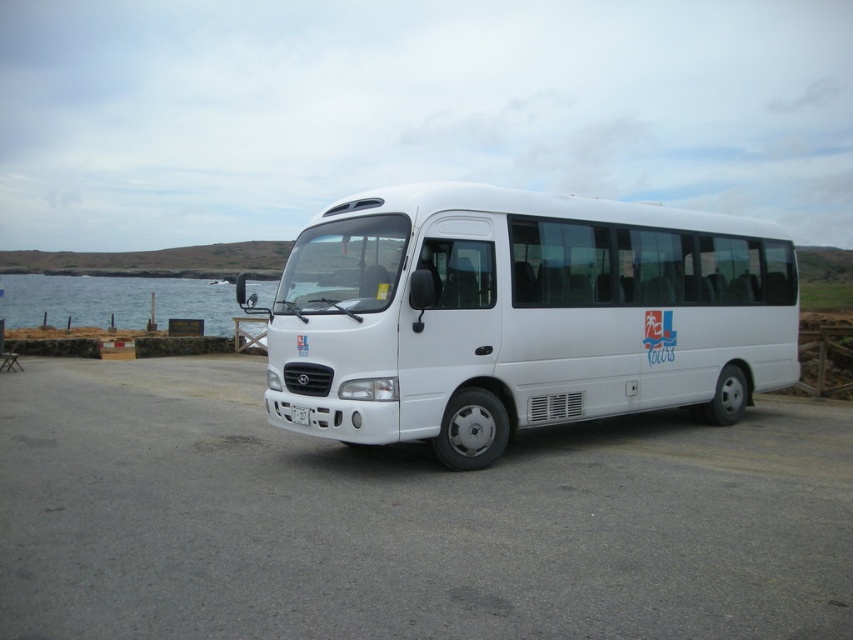
This screenshot has height=640, width=853. I want to click on white asphalt parking lot at center, so click(405, 522).

Is point (223, 577) positioned before point (276, 285)?

Yes, point (223, 577) is in front of point (276, 285).

What are the coordinates of `white asphalt parking lot at center` in the screenshot? It's located at (405, 522).

Find the location of a particular element. white asphalt parking lot at center is located at coordinates (405, 522).

Based on the photo, can you confirm if white matte bus at center is taller than blue water at left?

In fact, white matte bus at center may be shorter than blue water at left.

Which is above, white matte bus at center or blue water at left?

Positioned higher is blue water at left.

Which is in front, point (462, 340) or point (28, 314)?

Point (462, 340) is in front.

Where is `white matte bus at center`? The width and height of the screenshot is (853, 640). white matte bus at center is located at coordinates (520, 316).

Measure the distance from white asphalt parking lot at center to white matte bus at center.

white asphalt parking lot at center is 3.12 meters away from white matte bus at center.

How far apart are white asphalt parking lot at center and white matte bus at center?

The distance of white asphalt parking lot at center from white matte bus at center is 3.12 meters.

Is point (97, 547) in front of point (502, 452)?

Yes, point (97, 547) is closer to viewer.

Where is `white asphalt parking lot at center`? The width and height of the screenshot is (853, 640). white asphalt parking lot at center is located at coordinates (405, 522).